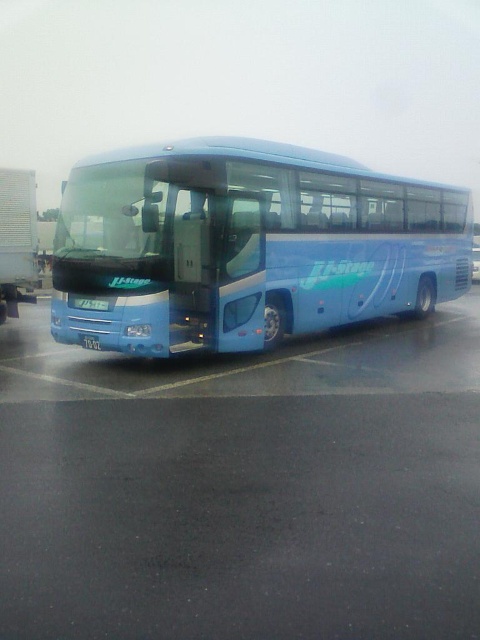
Who is lower down, blue glossy bus at center or white plastic license plate at center?

Positioned lower is white plastic license plate at center.

Image resolution: width=480 pixels, height=640 pixels. I want to click on blue glossy bus at center, so click(245, 246).

The width and height of the screenshot is (480, 640). Find the location of `blue glossy bus at center`. blue glossy bus at center is located at coordinates (245, 246).

Does point (228, 449) come closer to viewer compared to point (7, 289)?

Yes, point (228, 449) is closer to viewer.

Who is taller, black asphalt parking lot at center or white corrugated plastic trailer truck at left?

white corrugated plastic trailer truck at left is taller.

Between point (312, 484) and point (7, 310), which one is positioned behind?

Point (7, 310)

In order to click on black asphalt parking lot at center in this screenshot , I will do `click(243, 486)`.

Is black asphalt parking lot at center in front of white plastic license plate at center?

That is True.

Does black asphalt parking lot at center have a larger size compared to white plastic license plate at center?

Indeed, black asphalt parking lot at center has a larger size compared to white plastic license plate at center.

Find the location of a particular element. This screenshot has height=640, width=480. black asphalt parking lot at center is located at coordinates (243, 486).